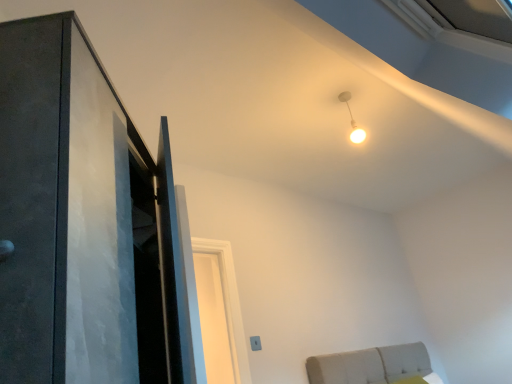
Question: Is white glossy light bulb at upper center positioned with its back to matte black door at left?

Choices:
 (A) no
 (B) yes

Answer: (A)

Question: Is white glossy light bulb at upper center next to matte black door at left and touching it?

Choices:
 (A) no
 (B) yes

Answer: (A)

Question: Could you tell me if white glossy light bulb at upper center is turned towards matte black door at left?

Choices:
 (A) yes
 (B) no

Answer: (A)

Question: Is white glossy light bulb at upper center positioned before matte black door at left?

Choices:
 (A) no
 (B) yes

Answer: (A)

Question: Considering the relative sizes of white glossy light bulb at upper center and matte black door at left in the image provided, is white glossy light bulb at upper center bigger than matte black door at left?

Choices:
 (A) no
 (B) yes

Answer: (A)

Question: Is matte black door at left inside white glossy light bulb at upper center?

Choices:
 (A) no
 (B) yes

Answer: (A)

Question: Considering the relative sizes of matte black door at left and white glossy light bulb at upper center in the image provided, is matte black door at left thinner than white glossy light bulb at upper center?

Choices:
 (A) yes
 (B) no

Answer: (B)

Question: Considering the relative sizes of matte black door at left and white glossy light bulb at upper center in the image provided, is matte black door at left smaller than white glossy light bulb at upper center?

Choices:
 (A) no
 (B) yes

Answer: (A)

Question: Would you say matte black door at left contains white glossy light bulb at upper center?

Choices:
 (A) yes
 (B) no

Answer: (B)

Question: Is matte black door at left closer to the viewer compared to white glossy light bulb at upper center?

Choices:
 (A) no
 (B) yes

Answer: (B)

Question: Considering the relative sizes of matte black door at left and white glossy light bulb at upper center in the image provided, is matte black door at left wider than white glossy light bulb at upper center?

Choices:
 (A) yes
 (B) no

Answer: (A)

Question: Is matte black door at left far from white glossy light bulb at upper center?

Choices:
 (A) yes
 (B) no

Answer: (A)

Question: Considering the relative positions of matte black door at left and white glossy light bulb at upper center in the image provided, is matte black door at left to the left or to the right of white glossy light bulb at upper center?

Choices:
 (A) left
 (B) right

Answer: (A)